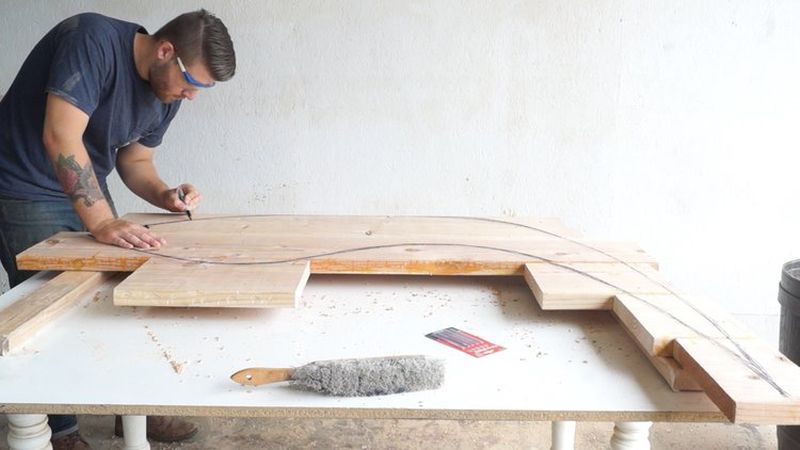
Locate an element on the screen. This screenshot has height=450, width=800. table legs is located at coordinates (32, 442), (134, 436), (556, 434), (633, 438).